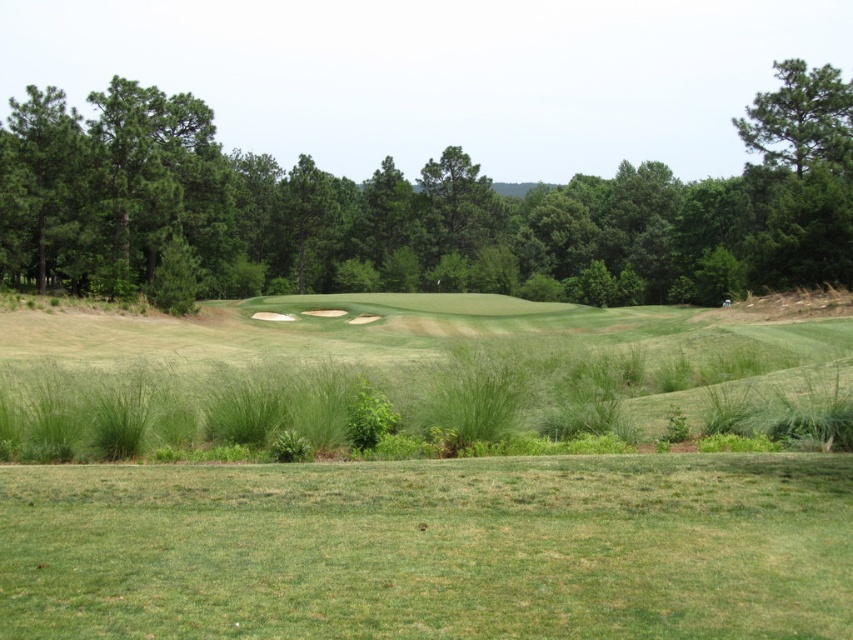
Question: Which object appears closest to the camera in this image?

Choices:
 (A) green leafy tree at upper center
 (B) green grass at lower center

Answer: (B)

Question: Does green grass at lower center lie behind green textured tree at upper right?

Choices:
 (A) no
 (B) yes

Answer: (A)

Question: Does green grass at lower center have a greater width compared to green textured tree at upper right?

Choices:
 (A) yes
 (B) no

Answer: (B)

Question: Which is nearer to the green grass at lower center?

Choices:
 (A) green textured tree at upper right
 (B) green leafy tree at upper center

Answer: (A)

Question: Among these objects, which one is nearest to the camera?

Choices:
 (A) green grass at lower center
 (B) green textured tree at upper right
 (C) green leafy tree at upper center

Answer: (A)

Question: Can you confirm if green leafy tree at upper center is positioned to the right of green textured tree at upper right?

Choices:
 (A) yes
 (B) no

Answer: (B)